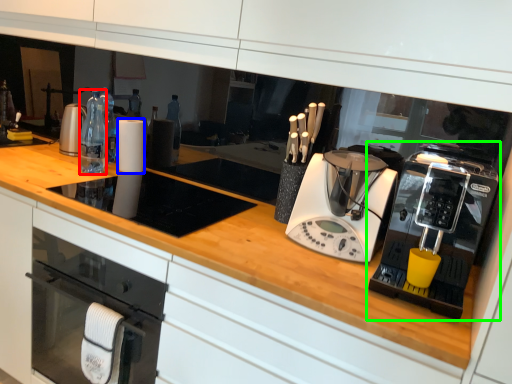
Question: Based on their relative distances, which object is nearer to bottle (highlighted by a red box)? Choose from paper towel (highlighted by a blue box) and home appliance (highlighted by a green box).

Choices:
 (A) paper towel
 (B) home appliance

Answer: (A)